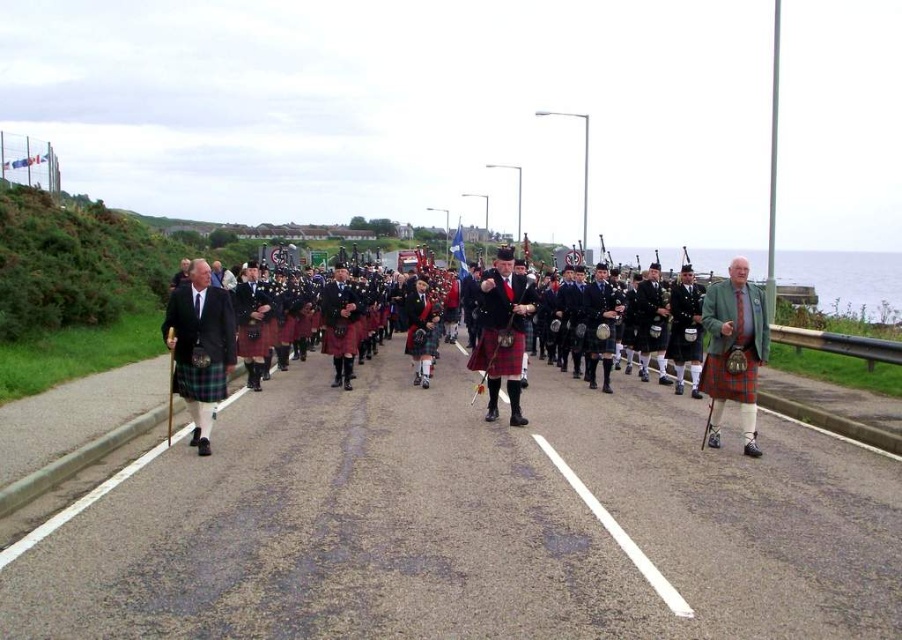
Does matte tartan kilt at center appear under red plaid kilt at center?

Correct, matte tartan kilt at center is located below red plaid kilt at center.

Does matte tartan kilt at center appear over red plaid kilt at center?

No.

Locate an element on the screen. This screenshot has height=640, width=902. matte tartan kilt at center is located at coordinates (502, 332).

Is matte black kilt at left closer to the viewer compared to matte tartan kilt at center?

Yes, it is in front of matte tartan kilt at center.

Does point (181, 310) lie in front of point (488, 300)?

Yes, it is.

Which is behind, point (198, 330) or point (488, 317)?

Point (488, 317)

This screenshot has width=902, height=640. What are the coordinates of `matte black kilt at left` in the screenshot? It's located at (199, 348).

Is matte green jacket at right closer to the viewer compared to red plaid kilt at center?

Yes, matte green jacket at right is in front of red plaid kilt at center.

What are the coordinates of `matte green jacket at right` in the screenshot? It's located at (733, 349).

Between point (741, 332) and point (430, 317), which one is positioned in front?

Point (741, 332)

The height and width of the screenshot is (640, 902). I want to click on matte green jacket at right, so click(x=733, y=349).